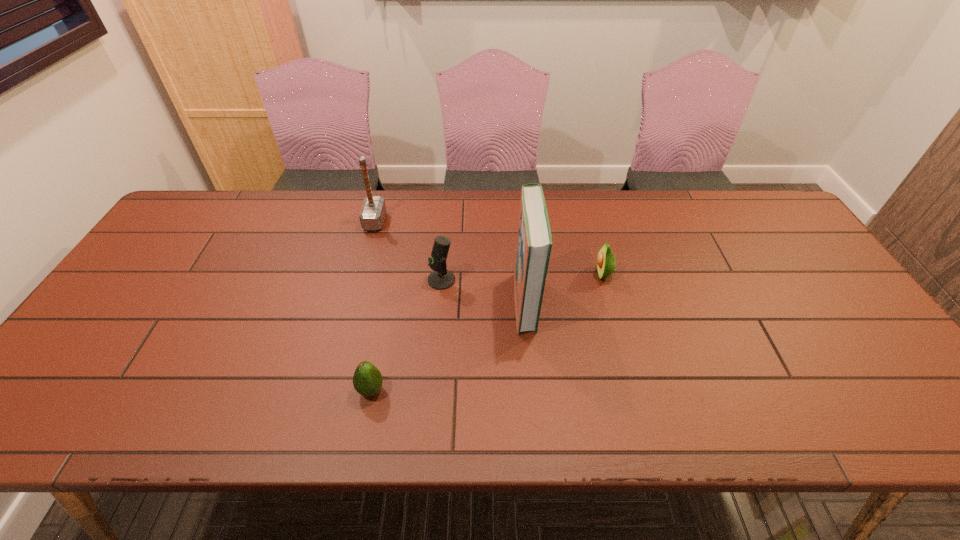
The image size is (960, 540). I want to click on object located in the near edge section of the desktop, so [367, 380].

Locate an element on the screen. vacant space at the far edge of the desktop is located at coordinates (255, 229).

In the image, there is a desktop. What are the coordinates of `free space at the near edge` in the screenshot? It's located at (836, 400).

Locate an element on the screen. The width and height of the screenshot is (960, 540). vacant point at the right edge is located at coordinates (807, 288).

Identify the location of vacant region at the far right corner of the desktop. (739, 224).

This screenshot has width=960, height=540. Find the location of `vacant space at the near right corner of the desktop`. vacant space at the near right corner of the desktop is located at coordinates (913, 430).

The image size is (960, 540). I want to click on vacant point located between the tallest object and the fourth object from right to left, so click(x=448, y=346).

Identify the location of unoccupied area between the microphone and the nearest object. (406, 335).

The width and height of the screenshot is (960, 540). Find the location of `free space between the rightmost object and the shorter avocado`. free space between the rightmost object and the shorter avocado is located at coordinates (487, 332).

At what (x,y) coordinates should I click in order to perform the action: click on free space between the second object from right to left and the third shortest object. Please return your answer as a coordinate pair (x, y). Looking at the image, I should click on (483, 291).